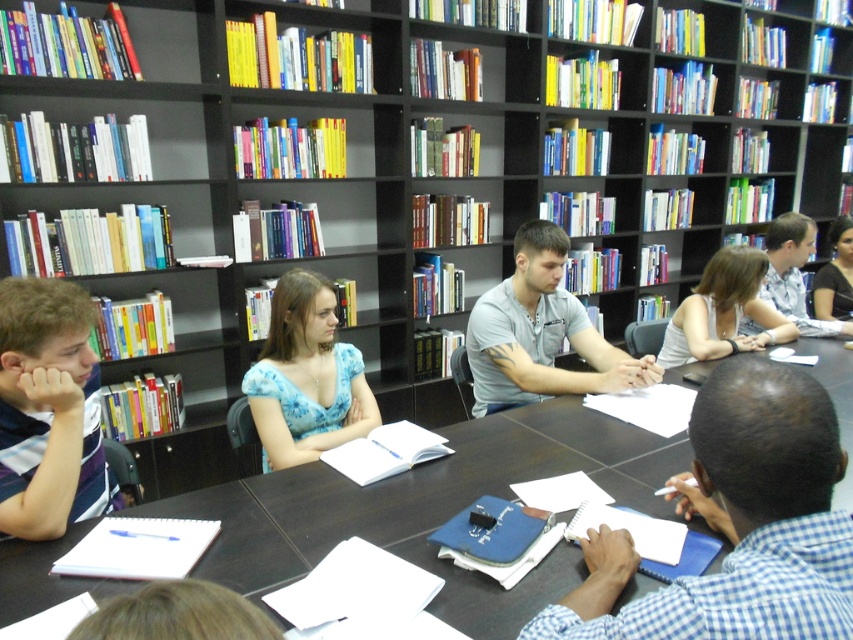
Does striped shirt at left appear over blue floral dress at center?

Incorrect, striped shirt at left is not positioned above blue floral dress at center.

Can you confirm if striped shirt at left is positioned below blue floral dress at center?

Yes, striped shirt at left is below blue floral dress at center.

Which is behind, point (42, 291) or point (279, 352)?

The point (279, 352) is more distant.

You are a GUI agent. You are given a task and a screenshot of the screen. Output one action in this format:
    pyautogui.click(x=<x>, y=<y>)
    Task: Click on the striped shirt at left
    This screenshot has height=640, width=853.
    Given the screenshot: What is the action you would take?
    pyautogui.click(x=48, y=410)

Find the location of a particular element. This screenshot has height=640, width=853. striped shirt at left is located at coordinates (48, 410).

Who is positioned more to the right, striped shirt at left or gray cotton shirt at center?

gray cotton shirt at center

The image size is (853, 640). What are the coordinates of `striped shirt at left` in the screenshot? It's located at (48, 410).

You are a GUI agent. You are given a task and a screenshot of the screen. Output one action in this format:
    pyautogui.click(x=<x>, y=<y>)
    Task: Click on the striped shirt at left
    
    Given the screenshot: What is the action you would take?
    pyautogui.click(x=48, y=410)

Does point (508, 348) come in front of point (741, 298)?

Yes, it is.

Between gray cotton shirt at center and white tank top at center, which one appears on the left side from the viewer's perspective?

gray cotton shirt at center

In order to click on gray cotton shirt at center in this screenshot , I will do `click(540, 332)`.